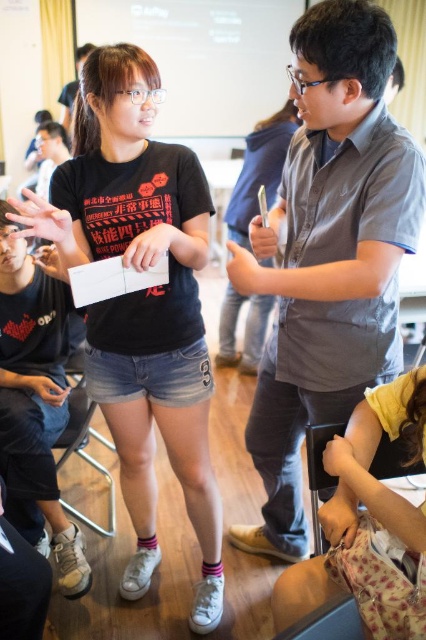
Measure the distance between gray cotton shirt at center and camera.

gray cotton shirt at center is 3.80 feet from camera.

Does point (305, 92) lie in front of point (152, 227)?

Yes, it is.

Describe the element at coordinates (328, 253) in the screenshot. I see `gray cotton shirt at center` at that location.

The image size is (426, 640). Identify the location of gray cotton shirt at center. (328, 253).